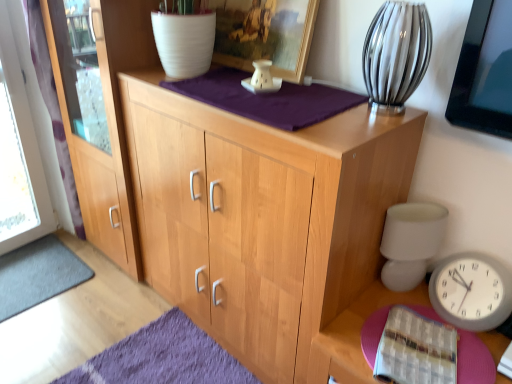
The image size is (512, 384). Find the location of `blank space situated above dark gray carpet at lower left (from a real-world perspective)`. blank space situated above dark gray carpet at lower left (from a real-world perspective) is located at coordinates (20, 273).